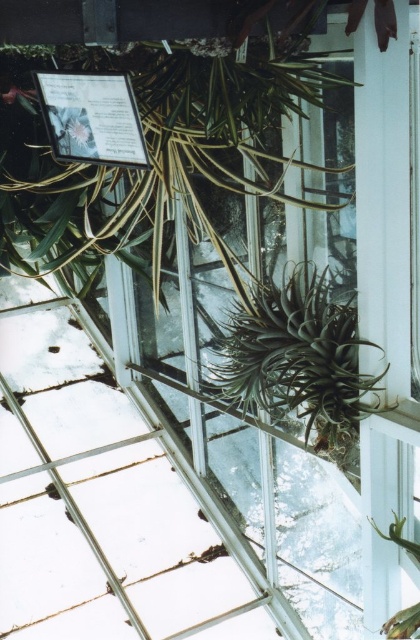
Question: Which point appears farthest from the camera in this image?

Choices:
 (A) (4, 221)
 (B) (262, 349)

Answer: (A)

Question: Which object appears closest to the camera in this image?

Choices:
 (A) matte silver plaque at upper left
 (B) green leafy plant at upper center

Answer: (B)

Question: Is the position of dark green spiky plant at center less distant than that of green spiky plant at lower right?

Choices:
 (A) no
 (B) yes

Answer: (A)

Question: Based on their relative distances, which object is nearer to the green leafy plant at upper center?

Choices:
 (A) matte silver plaque at upper left
 (B) dark green spiky plant at center

Answer: (B)

Question: Does matte silver plaque at upper left appear on the left side of green spiky plant at lower right?

Choices:
 (A) no
 (B) yes

Answer: (B)

Question: Does matte silver plaque at upper left have a greater width compared to green spiky plant at lower right?

Choices:
 (A) no
 (B) yes

Answer: (B)